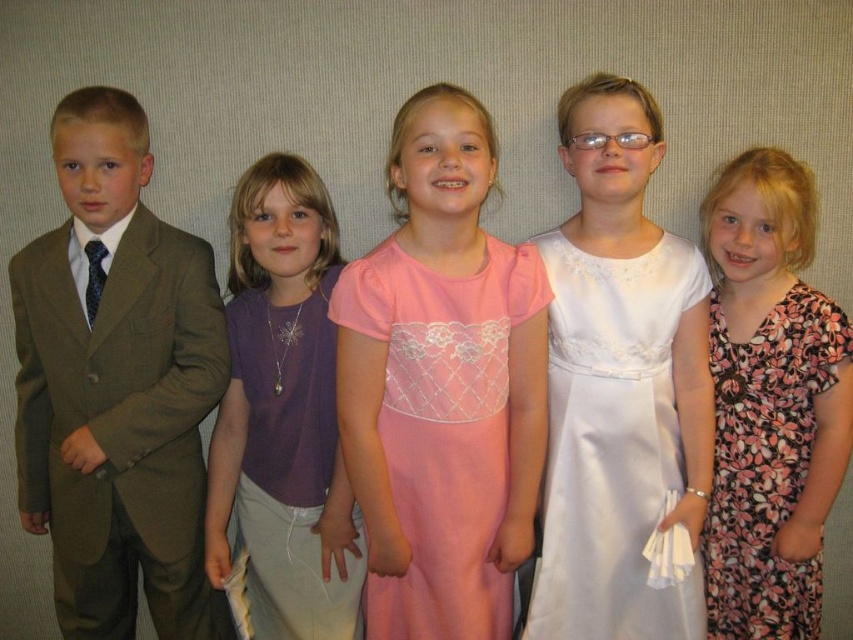
Question: Which object is the closest to the floral print dress at right?

Choices:
 (A) purple fabric shirt at center
 (B) white satin dress at center
 (C) matte brown suit at left
 (D) pink satin dress at center

Answer: (B)

Question: Does matte brown suit at left lie behind pink satin dress at center?

Choices:
 (A) yes
 (B) no

Answer: (A)

Question: Which is farther from the matte brown suit at left?

Choices:
 (A) pink satin dress at center
 (B) floral print dress at right
 (C) white satin dress at center

Answer: (B)

Question: Which point is farther from the camera taking this photo?

Choices:
 (A) (346, 593)
 (B) (738, 556)
 (C) (630, 388)
 (D) (125, 122)

Answer: (B)

Question: In this image, where is purple fabric shirt at center located relative to pink satin dress at center?

Choices:
 (A) below
 (B) above

Answer: (B)

Question: Considering the relative positions of matte brown suit at left and purple fabric shirt at center in the image provided, where is matte brown suit at left located with respect to purple fabric shirt at center?

Choices:
 (A) right
 (B) left

Answer: (B)